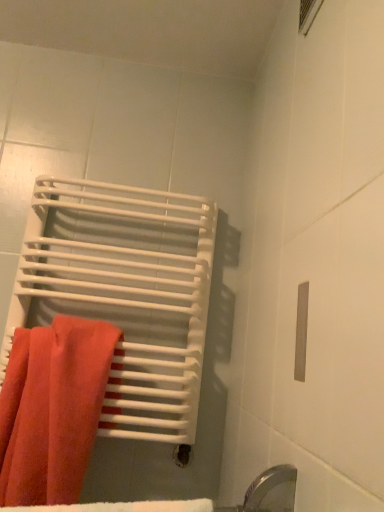
Question: Looking at the image, does matte orange towel at left seem bigger or smaller compared to matte white towel at left?

Choices:
 (A) big
 (B) small

Answer: (B)

Question: Is matte orange towel at left taller or shorter than matte white towel at left?

Choices:
 (A) short
 (B) tall

Answer: (A)

Question: From a real-world perspective, is matte orange towel at left above or below matte white towel at left?

Choices:
 (A) below
 (B) above

Answer: (A)

Question: From a real-world perspective, is matte white towel at left physically located above or below matte orange towel at left?

Choices:
 (A) above
 (B) below

Answer: (A)

Question: Which is correct: matte white towel at left is inside matte orange towel at left, or outside of it?

Choices:
 (A) outside
 (B) inside

Answer: (A)

Question: In the image, is matte white towel at left positioned in front of or behind matte orange towel at left?

Choices:
 (A) front
 (B) behind

Answer: (B)

Question: From the image's perspective, is matte white towel at left located above or below matte orange towel at left?

Choices:
 (A) above
 (B) below

Answer: (A)